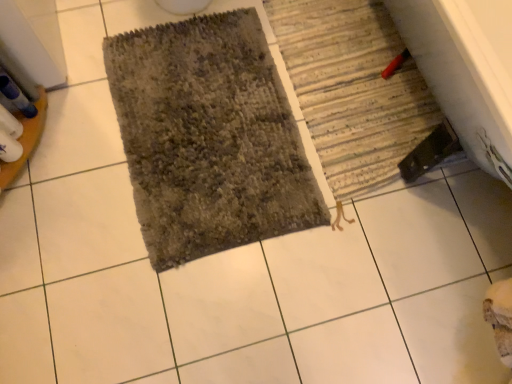
Identify the location of vacant region in front of textured gray bath mat at center, which is the 2th bath mat in right-to-left order. (184, 302).